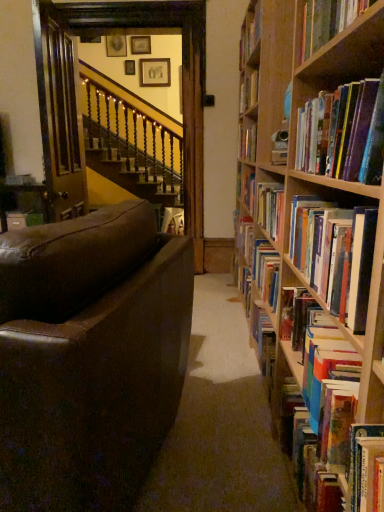
Question: Could you tell me if wooden picture frame at upper center, the 1th picture frame from the right, is turned towards hardcover book at right, which ranks as the fourth book in front-to-back order?

Choices:
 (A) yes
 (B) no

Answer: (A)

Question: From the image's perspective, is wooden picture frame at upper center, the 1th picture frame from the right, on top of hardcover book at right, placed as the 3th book when sorted from back to front?

Choices:
 (A) yes
 (B) no

Answer: (A)

Question: Is wooden picture frame at upper center, the 3th picture frame viewed from the left, bigger than hardcover book at right, placed as the 3th book when sorted from back to front?

Choices:
 (A) yes
 (B) no

Answer: (B)

Question: Is the surface of wooden picture frame at upper center, the 1th picture frame from the right, in direct contact with hardcover book at right, placed as the 3th book when sorted from back to front?

Choices:
 (A) no
 (B) yes

Answer: (A)

Question: Can you confirm if wooden picture frame at upper center, the 3th picture frame viewed from the left, is positioned to the right of hardcover book at right, placed as the 3th book when sorted from back to front?

Choices:
 (A) yes
 (B) no

Answer: (B)

Question: Is brown leather couch at left taller or shorter than wooden picture frame at upper center, the first picture frame in the left-to-right sequence?

Choices:
 (A) tall
 (B) short

Answer: (A)

Question: From the image's perspective, relative to wooden picture frame at upper center, the first picture frame in the left-to-right sequence, is brown leather couch at left above or below?

Choices:
 (A) below
 (B) above

Answer: (A)

Question: Looking at the image, does brown leather couch at left seem bigger or smaller compared to wooden picture frame at upper center, the first picture frame in the left-to-right sequence?

Choices:
 (A) big
 (B) small

Answer: (A)

Question: From a real-world perspective, relative to wooden picture frame at upper center, the first picture frame in the left-to-right sequence, is brown leather couch at left vertically above or below?

Choices:
 (A) above
 (B) below

Answer: (B)

Question: Is wooden picture frame at upper center, the first picture frame in the left-to-right sequence, taller or shorter than hardcover books at upper right, the sixth book from the back?

Choices:
 (A) tall
 (B) short

Answer: (A)

Question: From a real-world perspective, is wooden picture frame at upper center, the first picture frame in the left-to-right sequence, above or below hardcover books at upper right, the sixth book from the back?

Choices:
 (A) below
 (B) above

Answer: (B)

Question: From the image's perspective, is wooden picture frame at upper center, the 3th picture frame from the right, above or below hardcover books at upper right, which is counted as the 1th book, starting from the front?

Choices:
 (A) above
 (B) below

Answer: (A)

Question: Based on their positions, is wooden picture frame at upper center, the 3th picture frame from the right, located to the left or right of hardcover books at upper right, which is counted as the 1th book, starting from the front?

Choices:
 (A) left
 (B) right

Answer: (A)

Question: Visually, is wooden picture frame at upper center, which appears as the 2th picture frame when viewed from the right, positioned to the left or to the right of hardcover book at upper right, arranged as the 2th book when viewed from the front?

Choices:
 (A) left
 (B) right

Answer: (A)

Question: From the image's perspective, is wooden picture frame at upper center, which appears as the 2th picture frame when viewed from the right, positioned above or below hardcover book at upper right, arranged as the 2th book when viewed from the front?

Choices:
 (A) above
 (B) below

Answer: (A)